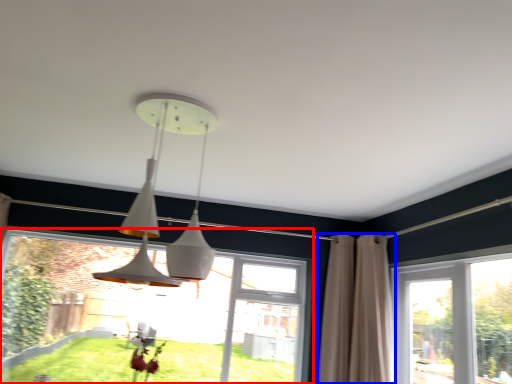
Question: Which point is further to the camera, window (highlighted by a red box) or curtain (highlighted by a blue box)?

Choices:
 (A) window
 (B) curtain

Answer: (A)